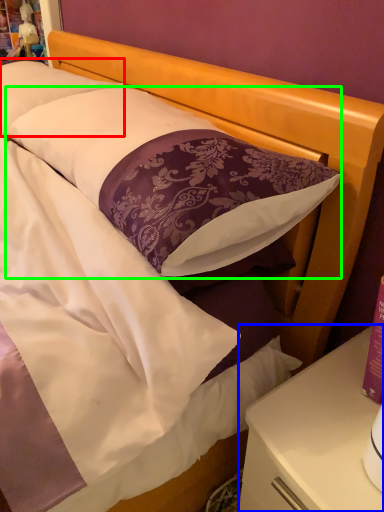
Question: Estimate the real-world distances between objects in this image. Which object is closer to pillow (highlighted by a red box), nightstand (highlighted by a blue box) or pillow (highlighted by a green box)?

Choices:
 (A) nightstand
 (B) pillow

Answer: (B)